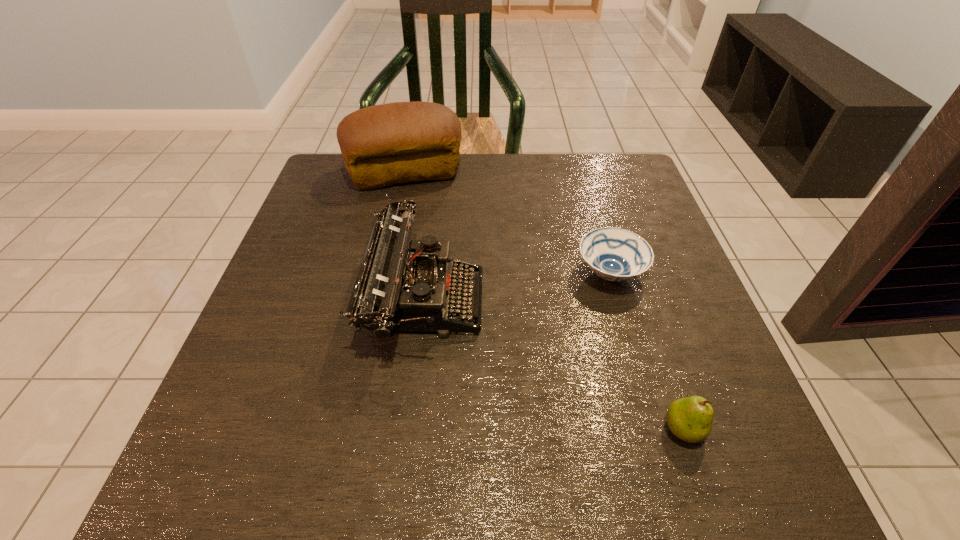
The image size is (960, 540). Find the location of `bread`. bread is located at coordinates (382, 145).

What are the coordinates of `the tallest object` in the screenshot? It's located at (382, 145).

Locate an element on the screen. This screenshot has height=540, width=960. typewriter is located at coordinates (397, 289).

Where is `pear`? This screenshot has height=540, width=960. pear is located at coordinates (690, 419).

This screenshot has width=960, height=540. In order to click on the nearest object in this screenshot , I will do `click(690, 419)`.

The width and height of the screenshot is (960, 540). What are the coordinates of `the shortest object` in the screenshot? It's located at (614, 254).

Locate an element on the screen. vacant space located on the front of the bread is located at coordinates (382, 289).

In order to click on free spot located 0.390m on the keyboard of the third shortest object in this screenshot , I will do `click(683, 299)`.

At what (x,y) coordinates should I click in order to perform the action: click on vacant space located 0.320m on the back of the pear. Please return your answer as a coordinate pair (x, y). This screenshot has width=960, height=540. Looking at the image, I should click on (629, 268).

Where is `vacant space located on the back of the shortest object`? This screenshot has height=540, width=960. vacant space located on the back of the shortest object is located at coordinates (589, 203).